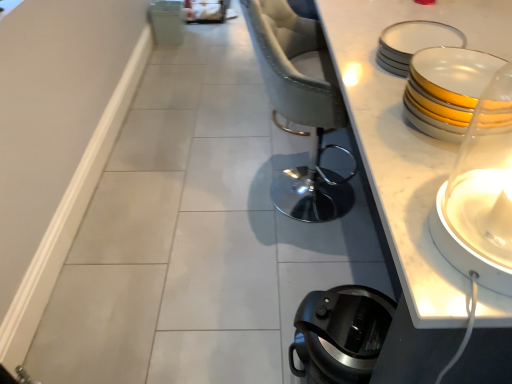
Question: From the image's perspective, does black plastic coffee pot at lower right appear lower than white glossy candle holder at right?

Choices:
 (A) yes
 (B) no

Answer: (A)

Question: Considering the relative sizes of black plastic coffee pot at lower right and white glossy candle holder at right in the image provided, is black plastic coffee pot at lower right wider than white glossy candle holder at right?

Choices:
 (A) no
 (B) yes

Answer: (B)

Question: Is black plastic coffee pot at lower right bigger than white glossy candle holder at right?

Choices:
 (A) no
 (B) yes

Answer: (B)

Question: From a real-world perspective, is black plastic coffee pot at lower right over white glossy candle holder at right?

Choices:
 (A) yes
 (B) no

Answer: (B)

Question: Is black plastic coffee pot at lower right beside white glossy candle holder at right?

Choices:
 (A) yes
 (B) no

Answer: (B)

Question: Is black plastic coffee pot at lower right not inside white glossy candle holder at right?

Choices:
 (A) yes
 (B) no

Answer: (A)

Question: Can you confirm if white porcelain plates at upper right, which appears as the first tableware when viewed from the back, is thinner than black plastic coffee pot at lower right?

Choices:
 (A) no
 (B) yes

Answer: (B)

Question: Is the depth of white porcelain plates at upper right, positioned as the second tableware in front-to-back order, less than that of black plastic coffee pot at lower right?

Choices:
 (A) no
 (B) yes

Answer: (A)

Question: Would you consider white porcelain plates at upper right, positioned as the second tableware in front-to-back order, to be distant from black plastic coffee pot at lower right?

Choices:
 (A) yes
 (B) no

Answer: (B)

Question: Is white porcelain plates at upper right, arranged as the 2th tableware when ordered from the bottom, outside of black plastic coffee pot at lower right?

Choices:
 (A) yes
 (B) no

Answer: (A)

Question: Does white porcelain plates at upper right, arranged as the 2th tableware when ordered from the bottom, have a smaller size compared to black plastic coffee pot at lower right?

Choices:
 (A) no
 (B) yes

Answer: (B)

Question: Is white porcelain plates at upper right, positioned as the second tableware in front-to-back order, to the right of black plastic coffee pot at lower right from the viewer's perspective?

Choices:
 (A) yes
 (B) no

Answer: (A)

Question: Considering the relative sizes of sleek gray fabric chair at center and black plastic coffee pot at lower right in the image provided, is sleek gray fabric chair at center thinner than black plastic coffee pot at lower right?

Choices:
 (A) no
 (B) yes

Answer: (A)